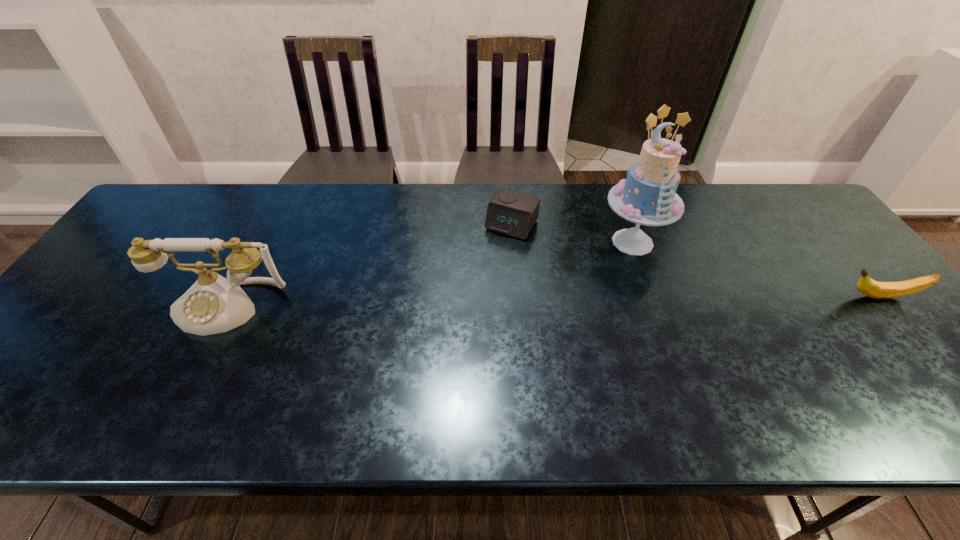
At what (x,y) coordinates should I click in order to perform the action: click on vacant area situated with a ladder on the side of the tallest object. Please return your answer as a coordinate pair (x, y). The width and height of the screenshot is (960, 540). Looking at the image, I should click on (626, 287).

Image resolution: width=960 pixels, height=540 pixels. I want to click on vacant space located with a ladder on the side of the tallest object, so click(612, 384).

What are the coordinates of `vacant position located with a ladder on the side of the tallest object` in the screenshot? It's located at click(618, 338).

Locate an element on the screen. The image size is (960, 540). vacant space located 0.110m on the front-facing side of the third object from right to left is located at coordinates (487, 264).

At what (x,y) coordinates should I click in order to perform the action: click on vacant point located on the front-facing side of the third object from right to left. Please return your answer as a coordinate pair (x, y). The height and width of the screenshot is (540, 960). Looking at the image, I should click on (452, 319).

You are a GUI agent. You are given a task and a screenshot of the screen. Output one action in this format:
    pyautogui.click(x=<x>, y=<y>)
    Task: Click on the vacant space situated on the front-facing side of the third object from right to left
    The image size is (960, 540).
    Given the screenshot: What is the action you would take?
    pyautogui.click(x=484, y=268)

You are a GUI agent. You are given a task and a screenshot of the screen. Output one action in this format:
    pyautogui.click(x=<x>, y=<y>)
    Task: Click on the cake located at the far edge
    The height and width of the screenshot is (540, 960).
    Given the screenshot: What is the action you would take?
    pyautogui.click(x=647, y=196)

The height and width of the screenshot is (540, 960). Identify the location of alarm clock present at the far edge. (511, 213).

The image size is (960, 540). I want to click on object located in the right edge section of the desktop, so click(878, 290).

Where is `vacant space at the far edge`? vacant space at the far edge is located at coordinates (746, 201).